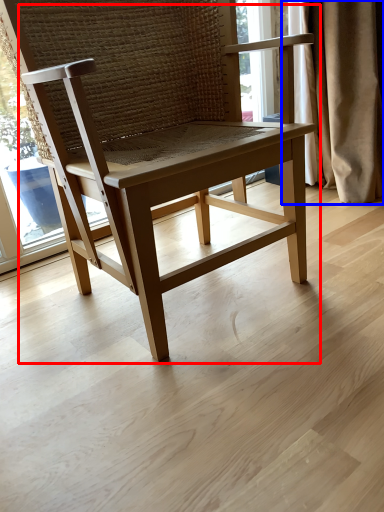
Question: Which of the following is the closest to the observer, chair (highlighted by a red box) or curtain (highlighted by a blue box)?

Choices:
 (A) chair
 (B) curtain

Answer: (A)